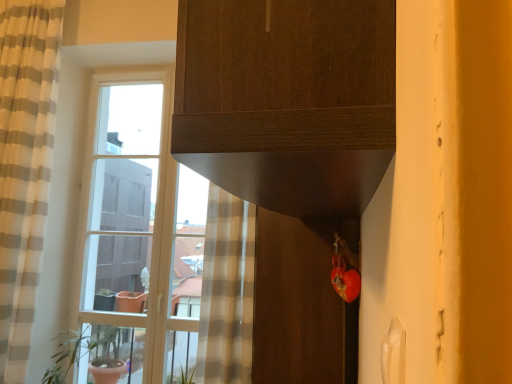
The image size is (512, 384). What do you see at coordinates (24, 164) in the screenshot? I see `beige striped curtain at left` at bounding box center [24, 164].

Image resolution: width=512 pixels, height=384 pixels. Identify the location of clear glass window at left. (158, 249).

How different are the orientations of matte brown screen door at lower center and beige striped curtain at left in degrees?

The angular difference between matte brown screen door at lower center and beige striped curtain at left is 90.5 degrees.

Which of these two, matte brown screen door at lower center or beige striped curtain at left, is bigger?

Bigger between the two is beige striped curtain at left.

Where is `curtain above the matte brown screen door at lower center (from a real-world perspective)`? Image resolution: width=512 pixels, height=384 pixels. curtain above the matte brown screen door at lower center (from a real-world perspective) is located at coordinates (24, 164).

In the scene shown: Is matte brown screen door at lower center next to beige striped curtain at left and touching it?

No, matte brown screen door at lower center is not beside beige striped curtain at left.

Does green matte plant pot at left have a smaller size compared to clear glass window at left?

Correct, green matte plant pot at left occupies less space than clear glass window at left.

Between green matte plant pot at left and clear glass window at left, which one has smaller width?

clear glass window at left is thinner.

How different are the orientations of green matte plant pot at left and clear glass window at left in degrees?

They differ by 0.201 degrees in their facing directions.

Is green matte plant pot at left touching clear glass window at left?

They are not placed beside each other.

Can you confirm if clear glass window at left is shorter than matte brown screen door at lower center?

No.

Can we say clear glass window at left lies outside matte brown screen door at lower center?

clear glass window at left is positioned outside matte brown screen door at lower center.

Is clear glass window at left in front of matte brown screen door at lower center?

That is False.

Is clear glass window at left facing towards matte brown screen door at lower center?

No, clear glass window at left does not turn towards matte brown screen door at lower center.

Is green matte plant pot at left next to beige striped curtain at left and touching it?

No, green matte plant pot at left is not touching beige striped curtain at left.

Is green matte plant pot at left positioned with its back to beige striped curtain at left?

No, green matte plant pot at left is not facing the opposite direction of beige striped curtain at left.

Find the location of a particular element. curtain that is in front of the green matte plant pot at left is located at coordinates (24, 164).

Based on their sizes in the image, would you say green matte plant pot at left is bigger or smaller than beige striped curtain at left?

Considering their sizes, green matte plant pot at left takes up less space than beige striped curtain at left.

Is point (5, 301) in front of point (102, 364)?

Yes, point (5, 301) is in front of point (102, 364).

Considering the sizes of objects beige striped curtain at left and green matte plant pot at left in the image provided, who is smaller, beige striped curtain at left or green matte plant pot at left?

green matte plant pot at left is smaller.

Considering the relative sizes of beige striped curtain at left and green matte plant pot at left in the image provided, is beige striped curtain at left wider than green matte plant pot at left?

No, beige striped curtain at left is not wider than green matte plant pot at left.

Is matte brown screen door at lower center positioned with its back to green matte plant pot at left?

That's not correct — matte brown screen door at lower center is not looking away from green matte plant pot at left.

Would you say green matte plant pot at left is part of matte brown screen door at lower center's contents?

No, green matte plant pot at left is located outside of matte brown screen door at lower center.

How different are the orientations of matte brown screen door at lower center and green matte plant pot at left in degrees?

They differ by 90.5 degrees in their facing directions.

From the image's perspective, is matte brown screen door at lower center beneath green matte plant pot at left?

Actually, matte brown screen door at lower center appears above green matte plant pot at left in the image.

Consider the image. Is clear glass window at left oriented away from green matte plant pot at left?

Yes, clear glass window at left is positioned with its back facing green matte plant pot at left.

In terms of width, does clear glass window at left look wider or thinner when compared to green matte plant pot at left?

clear glass window at left is thinner than green matte plant pot at left.

Are clear glass window at left and green matte plant pot at left far apart?

No.

Locate an element on the screen. The width and height of the screenshot is (512, 384). curtain on the left of matte brown screen door at lower center is located at coordinates (24, 164).

I want to click on window on the right of the green matte plant pot at left, so click(158, 249).

Based on their spatial positions, is green matte plant pot at left or clear glass window at left closer to matte brown screen door at lower center?

clear glass window at left is positioned closer to the anchor matte brown screen door at lower center.

Considering their positions, is beige striped curtain at left positioned closer to green matte plant pot at left than matte brown screen door at lower center?

beige striped curtain at left is closer to green matte plant pot at left.

Estimate the real-world distances between objects in this image. Which object is closer to beige striped curtain at left, clear glass window at left or green matte plant pot at left?

clear glass window at left.

Which object lies further to the anchor point beige striped curtain at left, green matte plant pot at left or clear glass window at left?

Based on the image, green matte plant pot at left appears to be further to beige striped curtain at left.

Consider the image. Considering their positions, is green matte plant pot at left positioned further to clear glass window at left than beige striped curtain at left?

green matte plant pot at left is positioned further to the anchor clear glass window at left.

Looking at the image, which one is located further to green matte plant pot at left, clear glass window at left or matte brown screen door at lower center?

matte brown screen door at lower center lies further to green matte plant pot at left than the other object.

When comparing their distances from clear glass window at left, does matte brown screen door at lower center or green matte plant pot at left seem closer?

green matte plant pot at left lies closer to clear glass window at left than the other object.

Considering their positions, is green matte plant pot at left positioned further to clear glass window at left than matte brown screen door at lower center?

matte brown screen door at lower center.

In order to click on window that lies between beige striped curtain at left and green matte plant pot at left from top to bottom in this screenshot , I will do 158,249.

At what (x,y) coordinates should I click in order to perform the action: click on window located between beige striped curtain at left and matte brown screen door at lower center in the left-right direction. Please return your answer as a coordinate pair (x, y). Looking at the image, I should click on (158, 249).

The height and width of the screenshot is (384, 512). Find the location of `window between green matte plant pot at left and matte brown screen door at lower center from left to right`. window between green matte plant pot at left and matte brown screen door at lower center from left to right is located at coordinates (158, 249).

Locate an element on the screen. The image size is (512, 384). houseplant between beige striped curtain at left and matte brown screen door at lower center is located at coordinates (85, 353).